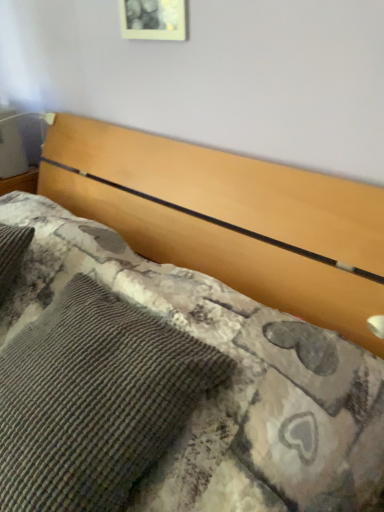
Question: Should I look upward or downward to see woolen textured pillow at upper center?

Choices:
 (A) down
 (B) up

Answer: (A)

Question: Considering the relative sizes of woolen textured pillow at upper center and matte white picture frame at upper center in the image provided, is woolen textured pillow at upper center thinner than matte white picture frame at upper center?

Choices:
 (A) no
 (B) yes

Answer: (A)

Question: Is woolen textured pillow at upper center oriented towards matte white picture frame at upper center?

Choices:
 (A) yes
 (B) no

Answer: (B)

Question: From a real-world perspective, is woolen textured pillow at upper center physically above matte white picture frame at upper center?

Choices:
 (A) yes
 (B) no

Answer: (B)

Question: From a real-world perspective, is woolen textured pillow at upper center under matte white picture frame at upper center?

Choices:
 (A) yes
 (B) no

Answer: (A)

Question: Can you confirm if woolen textured pillow at upper center is bigger than matte white picture frame at upper center?

Choices:
 (A) yes
 (B) no

Answer: (A)

Question: Could matte white picture frame at upper center be considered to be inside woolen textured pillow at upper center?

Choices:
 (A) no
 (B) yes

Answer: (A)

Question: From a real-world perspective, is matte white picture frame at upper center under woolen textured pillow at upper center?

Choices:
 (A) yes
 (B) no

Answer: (B)

Question: Does matte white picture frame at upper center turn towards woolen textured pillow at upper center?

Choices:
 (A) yes
 (B) no

Answer: (B)

Question: Is woolen textured pillow at upper center surrounded by matte white picture frame at upper center?

Choices:
 (A) yes
 (B) no

Answer: (B)

Question: Considering the relative sizes of matte white picture frame at upper center and woolen textured pillow at upper center in the image provided, is matte white picture frame at upper center smaller than woolen textured pillow at upper center?

Choices:
 (A) yes
 (B) no

Answer: (A)

Question: Would you consider matte white picture frame at upper center to be distant from woolen textured pillow at upper center?

Choices:
 (A) yes
 (B) no

Answer: (B)

Question: Does matte white picture frame at upper center have a greater width compared to woolen textured pillow at upper center?

Choices:
 (A) no
 (B) yes

Answer: (A)

Question: Considering their positions, is woolen textured pillow at upper center located in front of or behind matte white picture frame at upper center?

Choices:
 (A) behind
 (B) front

Answer: (B)